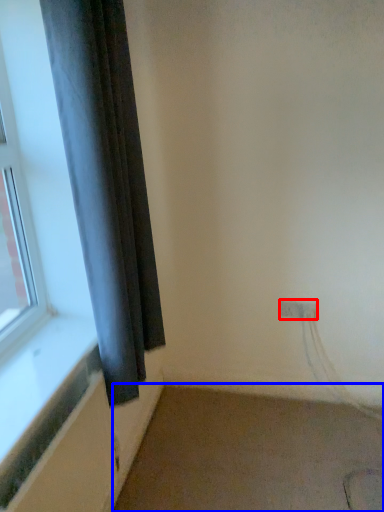
Question: Which object is closer to the camera taking this photo, electric outlet (highlighted by a red box) or plain (highlighted by a blue box)?

Choices:
 (A) electric outlet
 (B) plain

Answer: (B)